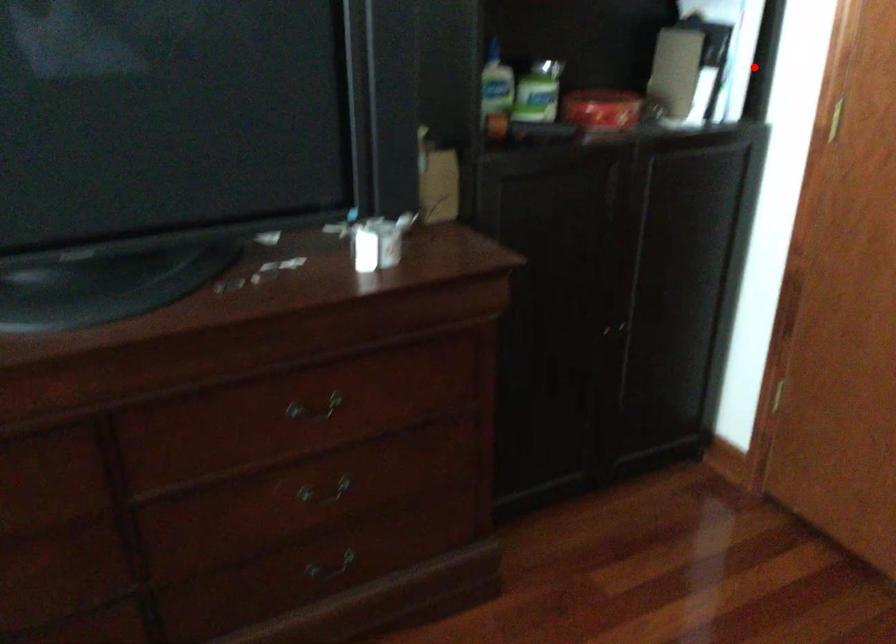
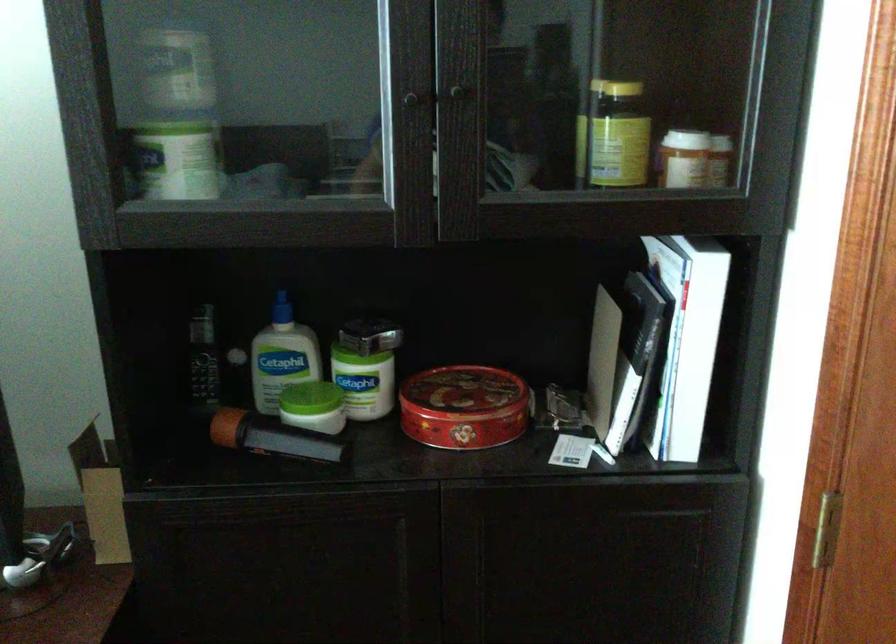
Locate, in the second image, the point that corresponds to the highlighted location in the first image.

(728, 373)